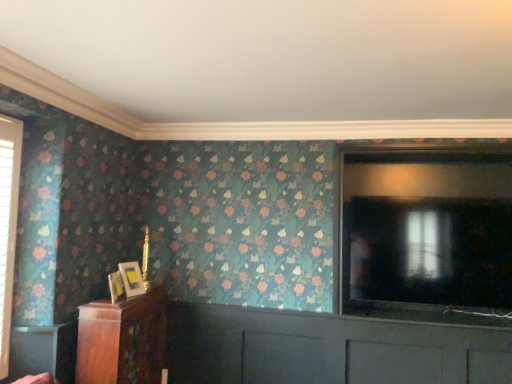
Where is `free space in front of matte gold picture frame at lower left, the first picture frame viewed from the back`? This screenshot has width=512, height=384. free space in front of matte gold picture frame at lower left, the first picture frame viewed from the back is located at coordinates (120, 304).